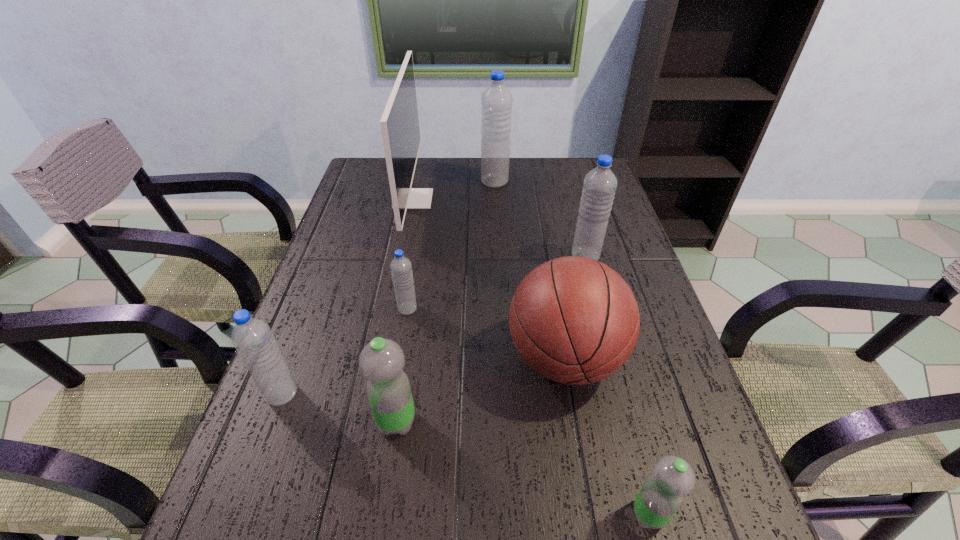
This screenshot has width=960, height=540. Find the location of `the fourth nearest water bottle`. the fourth nearest water bottle is located at coordinates (401, 268).

At what (x,y) coordinates should I click in order to perform the action: click on the smallest blue water bottle. Please return your answer as a coordinate pair (x, y). Looking at the image, I should click on (401, 268).

You are a GUI agent. You are given a task and a screenshot of the screen. Output one action in this format:
    pyautogui.click(x=<x>, y=<y>)
    Task: Click on the nearer green water bottle
    This screenshot has height=540, width=960.
    Given the screenshot: What is the action you would take?
    pyautogui.click(x=661, y=495)

Locate an element on the screen. The width and height of the screenshot is (960, 540). the right green water bottle is located at coordinates (661, 495).

Where is `free location located on the front-facing side of the monitor`? Image resolution: width=960 pixels, height=540 pixels. free location located on the front-facing side of the monitor is located at coordinates (531, 199).

Find the location of a particular element. The height and width of the screenshot is (540, 960). free location located 0.130m on the right of the farthest water bottle is located at coordinates click(x=547, y=182).

Identify the location of free region located on the left of the fifth nearest water bottle. Image resolution: width=960 pixels, height=540 pixels. (458, 256).

In order to click on vacant space located 0.330m on the back of the basketball in this screenshot , I will do `click(542, 232)`.

The width and height of the screenshot is (960, 540). Identify the location of vacant space situated on the right of the leftmost object. (465, 394).

You are a GUI agent. You are given a task and a screenshot of the screen. Output one action in this format:
    pyautogui.click(x=<x>, y=<y>)
    Task: Click on the vacant space situated 0.310m on the right of the bigger green water bottle
    This screenshot has height=540, width=960.
    Given the screenshot: What is the action you would take?
    pyautogui.click(x=576, y=422)